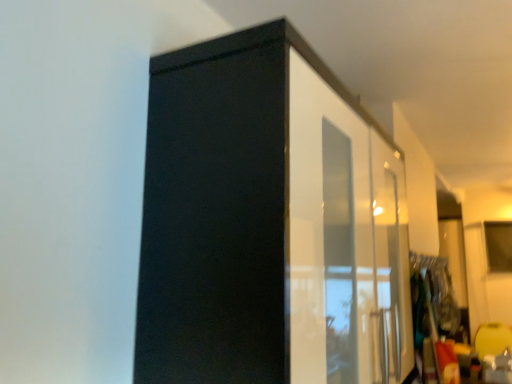
What is the approximate width of matte black cabinet at center?

matte black cabinet at center is 15.71 inches in width.

Measure the distance between point [180,142] and camera.

Point [180,142] is 33.43 inches from camera.

You are a GUI agent. You are given a task and a screenshot of the screen. Output one action in this format:
    pyautogui.click(x=<x>, y=<y>)
    Task: Click on the matte black cabinet at center
    Image resolution: width=512 pixels, height=384 pixels.
    Given the screenshot: What is the action you would take?
    pyautogui.click(x=267, y=222)

This screenshot has width=512, height=384. Describe the element at coordinates (267, 222) in the screenshot. I see `matte black cabinet at center` at that location.

Where is `matte black cabinet at center`? The width and height of the screenshot is (512, 384). matte black cabinet at center is located at coordinates (267, 222).